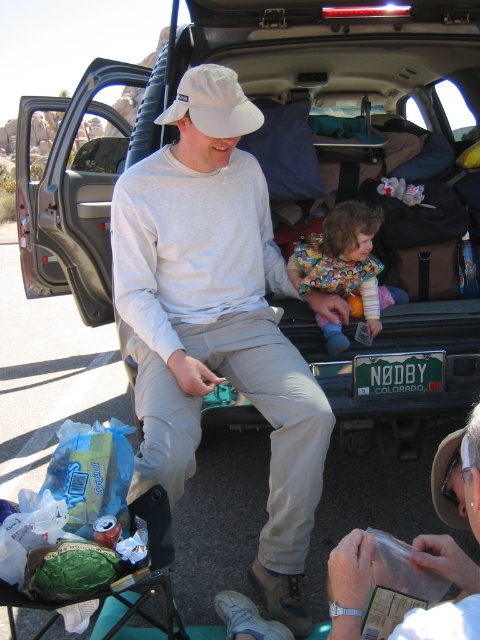
Question: Which point is farther to the camera?

Choices:
 (A) printed fabric dress at center
 (B) matte black truck at center
 (C) white matte hat at upper center

Answer: (A)

Question: From the image, what is the correct spatial relationship of matte black truck at center in relation to white matte hat at upper center?

Choices:
 (A) right
 (B) left

Answer: (A)

Question: Which point is farther from the camera taking this photo?

Choices:
 (A) (360, 228)
 (B) (210, 24)

Answer: (B)

Question: Is white matte hat at upper center smaller than printed fabric dress at center?

Choices:
 (A) yes
 (B) no

Answer: (B)

Question: Which is nearer to the matte black truck at center?

Choices:
 (A) printed fabric dress at center
 (B) white matte hat at upper center
 (C) white fabric baseball cap at center

Answer: (A)

Question: Observing the image, what is the correct spatial positioning of matte black truck at center in reference to printed fabric dress at center?

Choices:
 (A) below
 (B) above

Answer: (B)